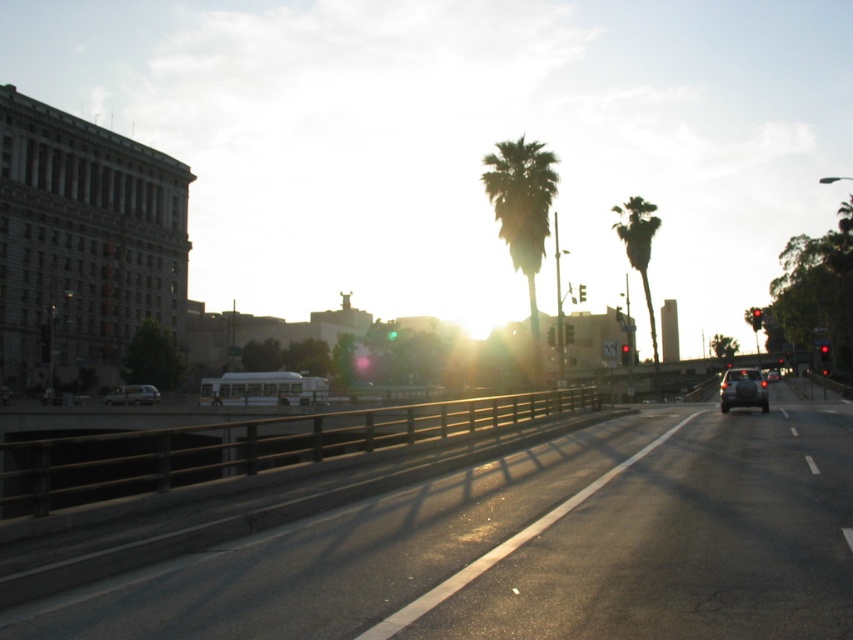
Does point (508, 144) lie in front of point (747, 385)?

That is False.

Between point (531, 145) and point (723, 387), which one is positioned in front?

Positioned in front is point (723, 387).

Where is `silhouette leafy palm at center`? The width and height of the screenshot is (853, 640). silhouette leafy palm at center is located at coordinates (521, 212).

Does black asphalt highway at center appear over silhouette leafy palm at center?

Incorrect, black asphalt highway at center is not positioned above silhouette leafy palm at center.

Which of these two, black asphalt highway at center or silhouette leafy palm at center, stands taller?

silhouette leafy palm at center is taller.

Is point (810, 452) in front of point (521, 166)?

Yes.

Where is `black asphalt highway at center`? black asphalt highway at center is located at coordinates (537, 547).

Based on the photo, which is above, silhouette leafy palm at center or green leafy palm tree at upper right?

Positioned higher is silhouette leafy palm at center.

Who is more distant from viewer, (490, 179) or (639, 218)?

Positioned behind is point (639, 218).

Is point (550, 161) more distant than point (630, 260)?

No, (550, 161) is closer to viewer.

The height and width of the screenshot is (640, 853). Identify the location of silhouette leafy palm at center. (521, 212).